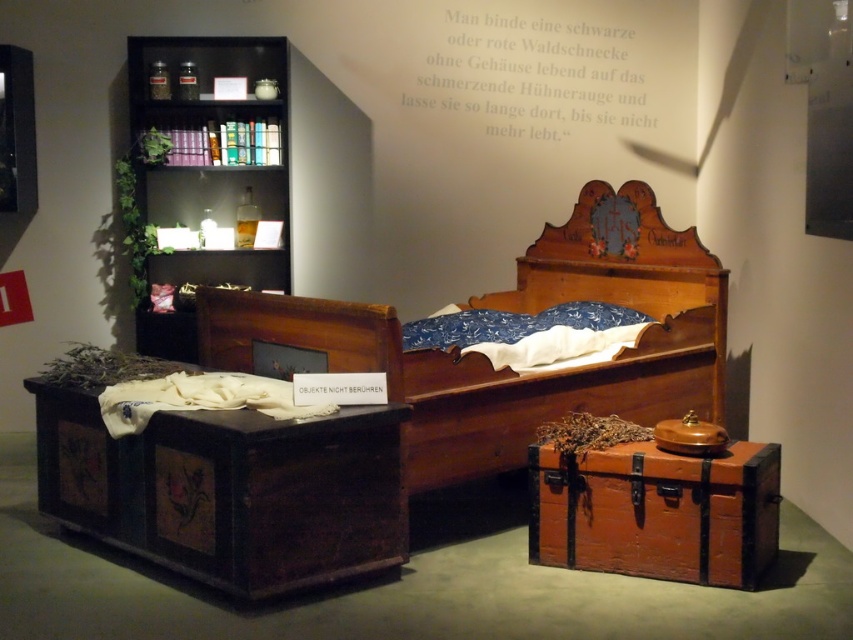
Question: Which point appears farthest from the camera in this image?

Choices:
 (A) (611, 312)
 (B) (453, 65)
 (C) (699, 404)
 (D) (227, 49)

Answer: (B)

Question: In this image, where is wooden bed at center located relative to wooden bookshelf at upper left?

Choices:
 (A) above
 (B) below

Answer: (B)

Question: From the image, what is the correct spatial relationship of wooden bed at center in relation to blue fabric pillow at center?

Choices:
 (A) above
 (B) below

Answer: (B)

Question: Estimate the real-world distances between objects in this image. Which object is closer to the white paper at upper center?

Choices:
 (A) wooden bookshelf at upper left
 (B) wooden bed at center
 (C) blue fabric pillow at center

Answer: (B)

Question: Which point is farther to the camera?

Choices:
 (A) white paper at upper center
 (B) wooden bed at center

Answer: (A)

Question: Does wooden bookshelf at upper left have a larger size compared to blue fabric pillow at center?

Choices:
 (A) no
 (B) yes

Answer: (B)